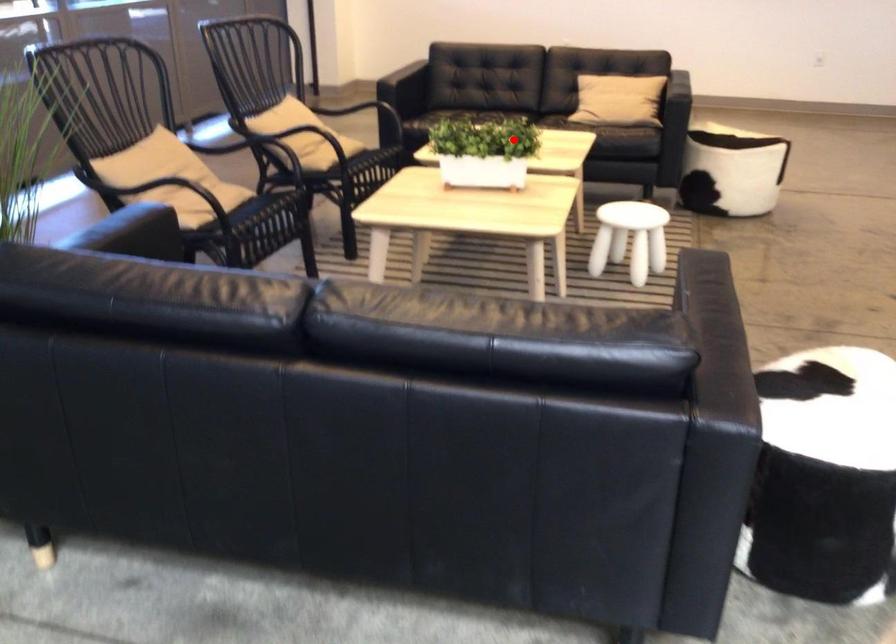
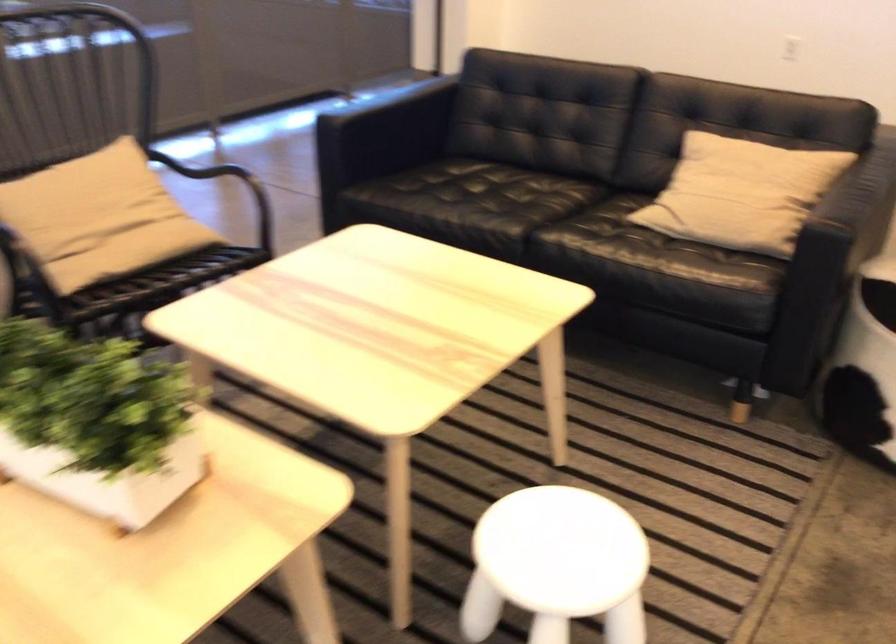
Question: I am providing you with two images of the same scene from different viewpoints. A red point is marked on the first image. Is the red point's position out of view in image 2?

Choices:
 (A) Yes
 (B) No

Answer: (B)